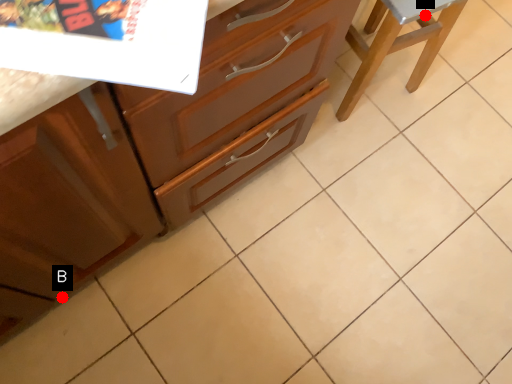
Question: Two points are circled on the image, labeled by A and B beside each circle. Which point is farther from the camera taking this photo?

Choices:
 (A) A is further
 (B) B is further

Answer: (A)